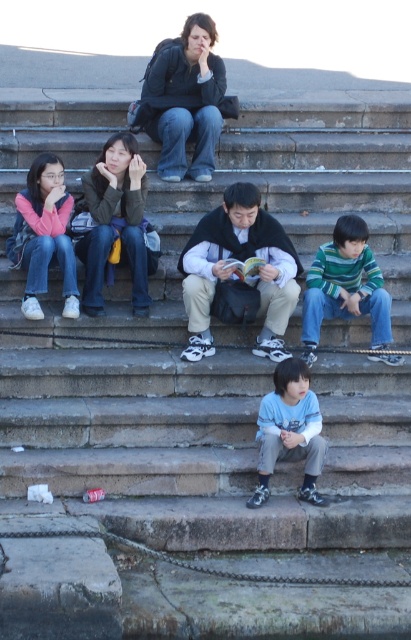
You are standing at the bottom of the stone steps and want to reach the point marked at coordinates (221, 362). Which direction should you walk to reach that point?

The point marked at coordinates (221, 362) is located at the center of the stone steps. To reach it from the bottom, you should walk straight ahead towards the center of the steps.

You are standing at the point labeled point (184, 355) and want to walk to the point labeled point (154, 333). Which direction should you move in relation to the steps?

You should move forward towards the top of the steps because point (154, 333) is behind point (184, 355), meaning it is in the upward direction along the steps.

You are a delivery person carrying a package that is 10 feet long. You need to place it between the stone steps at center and the matte pink sweater at left. Is there enough space to fit the package between them?

The distance between the stone steps at center and the matte pink sweater at left is 12.08 feet. Since the package is 10 feet long, there is enough space to fit it between them as the available space is longer than the package.